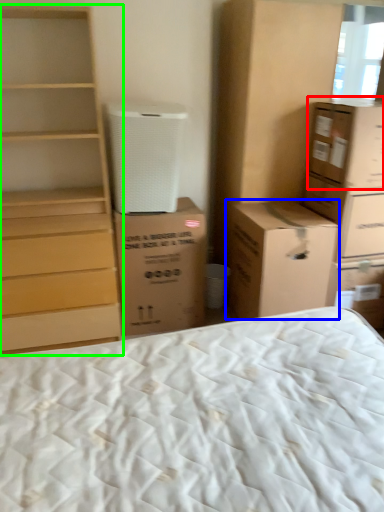
Question: Which is farther away from cardboard box (highlighted by a red box)? cardboard box (highlighted by a blue box) or chest of drawers (highlighted by a green box)?

Choices:
 (A) cardboard box
 (B) chest of drawers

Answer: (B)